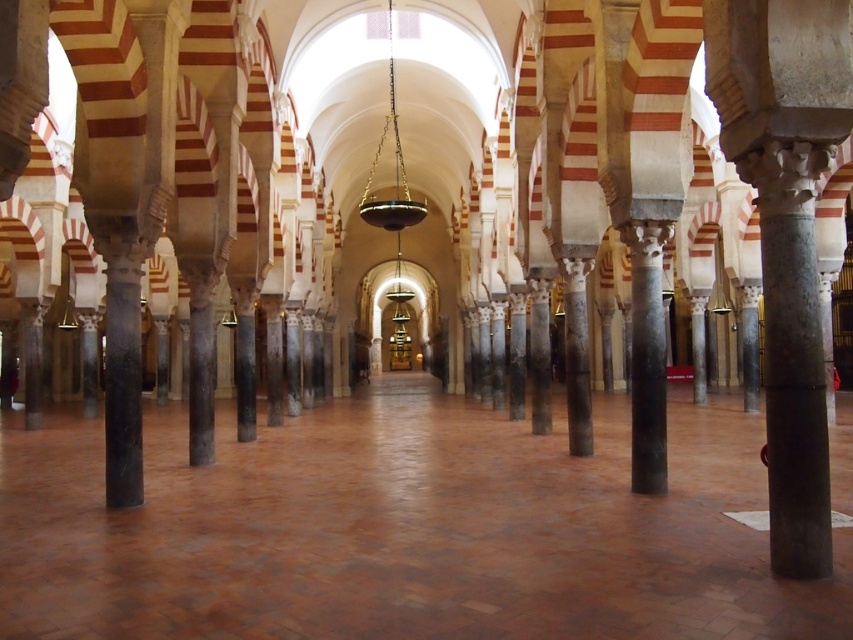
You are an architect designing a new building and want to ensure that the central columns are visually balanced. Given that the marble column at center and the black marble pillar at center are both central features, which one is wider and should be considered for symmetry adjustments?

The marble column at center is wider than the black marble pillar at center, so adjustments should be made to ensure symmetry between them.

You are an architect examining the interior of a grand historical building. You notice the marble column at center and the black marble pillar at center. Which one appears bigger in size?

The marble column at center has a larger size compared to the black marble pillar at center, so it appears bigger in size.